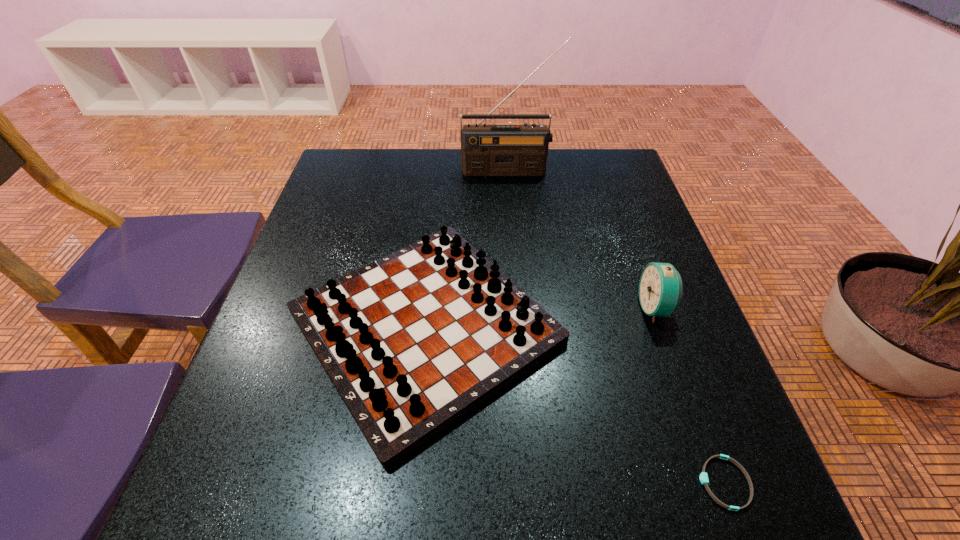
Identify the location of radio receiver. (486, 150).

I want to click on the farthest object, so click(486, 150).

Where is `alarm clock`? This screenshot has height=540, width=960. alarm clock is located at coordinates (660, 289).

Locate an element on the screen. The image size is (960, 540). chessboard is located at coordinates (413, 341).

Locate an element on the screen. the shortest object is located at coordinates (704, 480).

The width and height of the screenshot is (960, 540). In order to click on free location located on the front-facing side of the radio receiver in this screenshot , I will do `click(512, 215)`.

Locate an element on the screen. Image resolution: width=960 pixels, height=540 pixels. vacant space located on the front-facing side of the alarm clock is located at coordinates (515, 308).

The image size is (960, 540). Identify the location of free space located on the front-facing side of the alarm clock. (563, 308).

I want to click on vacant point located on the front-facing side of the alarm clock, so click(x=471, y=308).

In order to click on free spot located 0.280m on the back of the chessboard in this screenshot , I will do `click(442, 172)`.